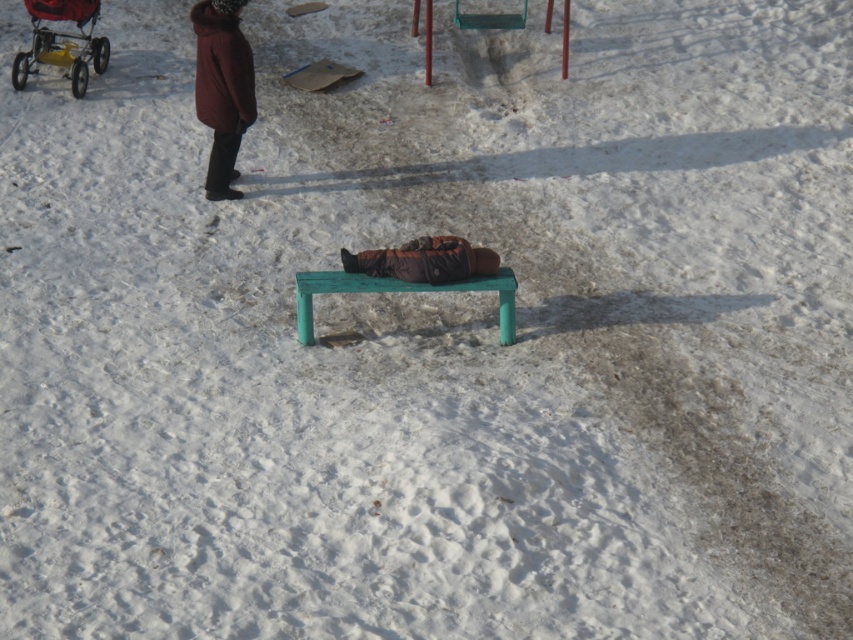
You are a park attendant and need to locate the burgundy wool coat at upper left. According to the coordinates provided, where exactly should you look in the image?

The burgundy wool coat at upper left is located at point coordinates [222,88].

You are a delivery person trying to navigate through the snowy park. You need to deliver a package to the stroller located at the upper left corner. According to the map coordinates provided, where exactly should you head to find the yellow plastic baby carriage at upper left?

The yellow plastic baby carriage at upper left is located at coordinates point (x=62, y=42).